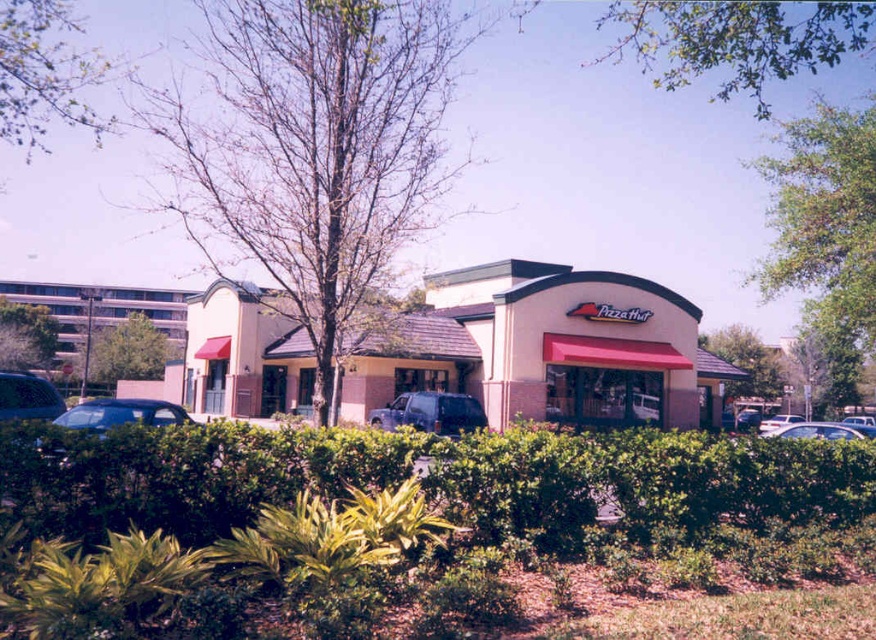
Can you confirm if green leafy bush at center is positioned to the right of matte black car at left?

In fact, green leafy bush at center is to the left of matte black car at left.

Where is `green leafy bush at center`? The image size is (876, 640). green leafy bush at center is located at coordinates (129, 352).

Where is `green leafy bush at center`? The image size is (876, 640). green leafy bush at center is located at coordinates point(129,352).

Does green leafy bush at lower left appear over white matte car at center?

Yes.

This screenshot has width=876, height=640. I want to click on green leafy bush at lower left, so click(x=25, y=337).

Does point (47, 332) come closer to viewer compared to point (106, 400)?

No, (47, 332) is further to viewer.

Can you confirm if green leafy bush at lower left is thinner than matte black car at lower left?

Yes, green leafy bush at lower left is thinner than matte black car at lower left.

Is point (36, 317) behind point (79, 426)?

Yes.

Where is `green leafy bush at lower left`? green leafy bush at lower left is located at coordinates (25, 337).